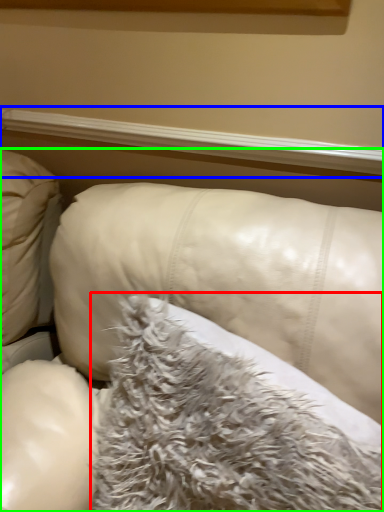
Question: Which object is the closest to the pillow (highlighted by a red box)? Choose among these: window sill (highlighted by a blue box) or furniture (highlighted by a green box).

Choices:
 (A) window sill
 (B) furniture

Answer: (B)